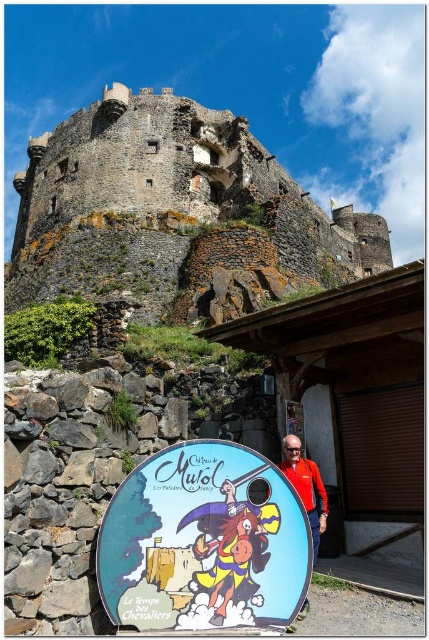
Question: Is rusty stone castle at upper center smaller than matte plastic shield at center?

Choices:
 (A) yes
 (B) no

Answer: (B)

Question: Which of the following is the closest to the observer?

Choices:
 (A) (156, 481)
 (B) (325, 515)
 (C) (375, 268)

Answer: (A)

Question: Among these objects, which one is farthest from the camera?

Choices:
 (A) matte plastic shield at center
 (B) rusty stone castle at upper center

Answer: (B)

Question: Is rusty stone castle at upper center positioned before matte plastic shield at center?

Choices:
 (A) yes
 (B) no

Answer: (B)

Question: Is rusty stone castle at upper center below matte plastic shield at center?

Choices:
 (A) no
 (B) yes

Answer: (A)

Question: Which point appears closest to the camera in this image?

Choices:
 (A) (190, 253)
 (B) (305, 486)

Answer: (B)